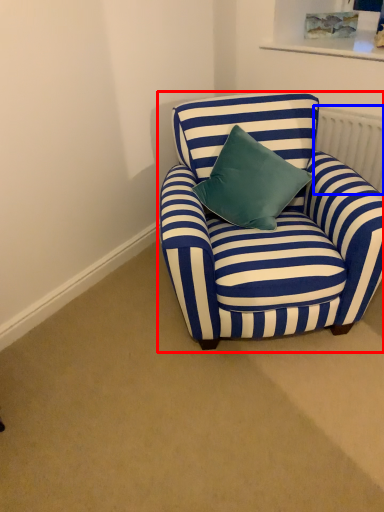
Question: Which object appears closest to the camera in this image, chair (highlighted by a red box) or radiator (highlighted by a blue box)?

Choices:
 (A) chair
 (B) radiator

Answer: (A)